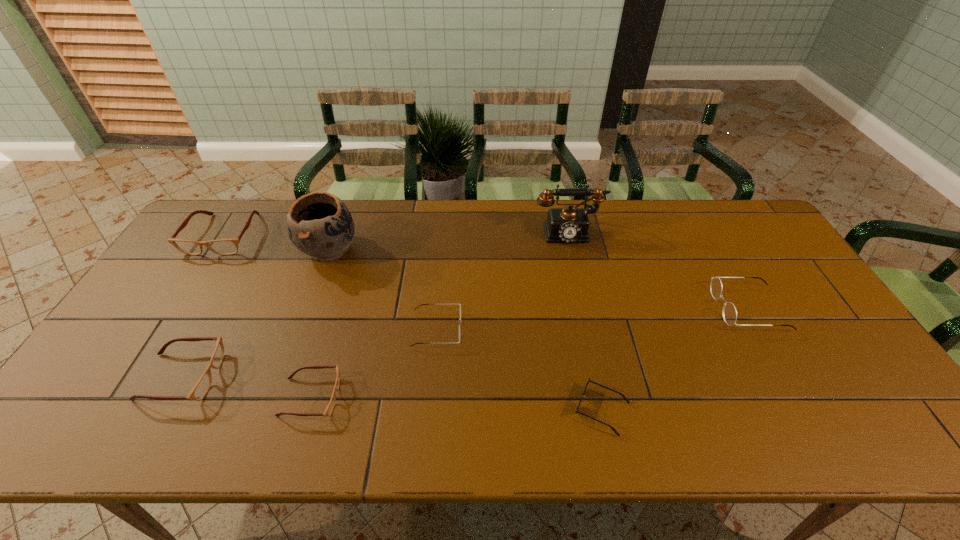
Identify the location of object that is positioned at the right edge. The width and height of the screenshot is (960, 540). (730, 313).

You are a GUI agent. You are given a task and a screenshot of the screen. Output one action in this format:
    pyautogui.click(x=<x>, y=<y>)
    Task: Click on the object positioned at the far left corner
    
    Given the screenshot: What is the action you would take?
    pyautogui.click(x=223, y=246)

Where is `free space at the far edge of the desktop`? The image size is (960, 540). free space at the far edge of the desktop is located at coordinates (400, 203).

Locate an element on the screen. The width and height of the screenshot is (960, 540). blank space at the near edge is located at coordinates (499, 409).

Where is `free point at the left edge`? The width and height of the screenshot is (960, 540). free point at the left edge is located at coordinates (186, 272).

This screenshot has height=540, width=960. Find the location of `vacant space at the right edge`. vacant space at the right edge is located at coordinates (798, 310).

Locate an element on the screen. vacant space at the far left corner of the desktop is located at coordinates 225,223.

At what (x,y) coordinates should I click in order to perform the action: click on free spot between the rightmost spectacles and the second biggest brown spectacles. Please return your answer as a coordinate pair (x, y). This screenshot has height=540, width=960. Looking at the image, I should click on (466, 342).

Find the location of a particular element. The image size is (960, 540). vacant area that lies between the shortest spectacles and the bigger black spectacles is located at coordinates (530, 353).

Where is `vacant point located between the right black spectacles and the shortest spectacles`? The image size is (960, 540). vacant point located between the right black spectacles and the shortest spectacles is located at coordinates (530, 353).